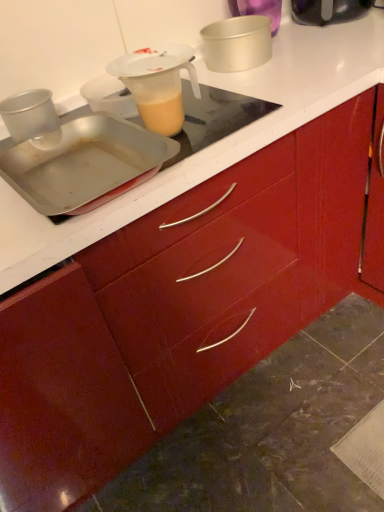
Find the location of `translucent plastic jug at upper center`. translucent plastic jug at upper center is located at coordinates (158, 84).

I want to click on metallic silver tray at upper left, which ranks as the 1th kitchen appliance in bottom-to-top order, so click(x=84, y=164).

Is metallic silver tray at upper left, arranged as the fourth kitchen appliance when viewed from the top, further to the viewer compared to translucent plastic jug at upper center?

No, it is in front of translucent plastic jug at upper center.

From the picture: Considering the sizes of objects metallic silver tray at upper left, arranged as the fourth kitchen appliance when viewed from the top, and translucent plastic jug at upper center in the image provided, who is wider, metallic silver tray at upper left, arranged as the fourth kitchen appliance when viewed from the top, or translucent plastic jug at upper center?

metallic silver tray at upper left, arranged as the fourth kitchen appliance when viewed from the top, is wider.

Measure the distance from metallic silver tray at upper left, arranged as the fourth kitchen appliance when viewed from the top, to translucent plastic jug at upper center.

A distance of 6.28 inches exists between metallic silver tray at upper left, arranged as the fourth kitchen appliance when viewed from the top, and translucent plastic jug at upper center.

Is metallic silver tray at upper left, which is the third kitchen appliance in right-to-left order, taller than translucent plastic jug at upper center?

Incorrect, the height of metallic silver tray at upper left, which is the third kitchen appliance in right-to-left order, is not larger of that of translucent plastic jug at upper center.

Would you say translucent plastic jug at upper center is outside metallic silver cake pan at upper center, the third kitchen appliance in the left-to-right sequence?

Indeed, translucent plastic jug at upper center is completely outside metallic silver cake pan at upper center, the third kitchen appliance in the left-to-right sequence.

Where is `the 2nd kitchen appliance positioned below the translucent plastic jug at upper center (from a real-world perspective)`? the 2nd kitchen appliance positioned below the translucent plastic jug at upper center (from a real-world perspective) is located at coordinates (237, 42).

In the scene shown: Are translucent plastic jug at upper center and metallic silver cake pan at upper center, which is counted as the third kitchen appliance, starting from the bottom, making contact?

No, translucent plastic jug at upper center is not making contact with metallic silver cake pan at upper center, which is counted as the third kitchen appliance, starting from the bottom.

Can you confirm if translucent plastic jug at upper center is bigger than metallic silver cake pan at upper center, which is counted as the third kitchen appliance, starting from the bottom?

No.

Consider the image. Does metallic silver tray at upper left, which ranks as the 1th kitchen appliance in bottom-to-top order, have a lesser width compared to metallic silver cake pan at upper center, the second kitchen appliance when ordered from right to left?

In fact, metallic silver tray at upper left, which ranks as the 1th kitchen appliance in bottom-to-top order, might be wider than metallic silver cake pan at upper center, the second kitchen appliance when ordered from right to left.

This screenshot has height=512, width=384. Identify the location of the 2nd kitchen appliance below when counting from the metallic silver cake pan at upper center, the second kitchen appliance when ordered from right to left (from the image's perspective). (84, 164).

Is metallic silver tray at upper left, the 2th kitchen appliance from the left, bigger than metallic silver cake pan at upper center, which is counted as the third kitchen appliance, starting from the bottom?

Indeed, metallic silver tray at upper left, the 2th kitchen appliance from the left, has a larger size compared to metallic silver cake pan at upper center, which is counted as the third kitchen appliance, starting from the bottom.

Considering the relative positions of black plastic toaster at upper right, positioned as the fourth kitchen appliance in left-to-right order, and metallic silver cup at left, which is the 2th kitchen appliance in bottom-to-top order, in the image provided, is black plastic toaster at upper right, positioned as the fourth kitchen appliance in left-to-right order, to the left of metallic silver cup at left, which is the 2th kitchen appliance in bottom-to-top order, from the viewer's perspective?

Incorrect, black plastic toaster at upper right, positioned as the fourth kitchen appliance in left-to-right order, is not on the left side of metallic silver cup at left, which is the 2th kitchen appliance in bottom-to-top order.

Which is nearer, (329, 8) or (46, 103)?

Point (329, 8) is farther from the camera than point (46, 103).

Are black plastic toaster at upper right, which is the 4th kitchen appliance in bottom-to-top order, and metallic silver cup at left, which appears as the first kitchen appliance when viewed from the left, located far from each other?

No, black plastic toaster at upper right, which is the 4th kitchen appliance in bottom-to-top order, is not far away from metallic silver cup at left, which appears as the first kitchen appliance when viewed from the left.

Would you say black plastic toaster at upper right, positioned as the fourth kitchen appliance in left-to-right order, is outside metallic silver cup at left, which is the 2th kitchen appliance in bottom-to-top order?

Yes, black plastic toaster at upper right, positioned as the fourth kitchen appliance in left-to-right order, is not within metallic silver cup at left, which is the 2th kitchen appliance in bottom-to-top order.

Based on the photo, is translucent plastic jug at upper center positioned with its back to metallic silver cup at left, the fourth kitchen appliance positioned from the right?

No, metallic silver cup at left, the fourth kitchen appliance positioned from the right, is not at the back of translucent plastic jug at upper center.

Would you say translucent plastic jug at upper center is inside or outside metallic silver cup at left, positioned as the third kitchen appliance in top-to-bottom order?

translucent plastic jug at upper center lies outside metallic silver cup at left, positioned as the third kitchen appliance in top-to-bottom order.

Is translucent plastic jug at upper center wider or thinner than metallic silver cup at left, the fourth kitchen appliance positioned from the right?

translucent plastic jug at upper center is wider than metallic silver cup at left, the fourth kitchen appliance positioned from the right.

Which point is more distant from viewer, (172, 99) or (38, 96)?

Point (38, 96)

Is translucent plastic jug at upper center to the left of black plastic toaster at upper right, positioned as the fourth kitchen appliance in left-to-right order, from the viewer's perspective?

Indeed, translucent plastic jug at upper center is positioned on the left side of black plastic toaster at upper right, positioned as the fourth kitchen appliance in left-to-right order.

Is point (157, 71) positioned in front of point (360, 4)?

Yes, it is in front of point (360, 4).

Is translucent plastic jug at upper center outside of black plastic toaster at upper right, positioned as the 1th kitchen appliance in top-to-bottom order?

Yes, translucent plastic jug at upper center is outside of black plastic toaster at upper right, positioned as the 1th kitchen appliance in top-to-bottom order.

In terms of height, does translucent plastic jug at upper center look taller or shorter compared to black plastic toaster at upper right, positioned as the 1th kitchen appliance in top-to-bottom order?

In the image, translucent plastic jug at upper center appears to be taller than black plastic toaster at upper right, positioned as the 1th kitchen appliance in top-to-bottom order.

Is metallic silver tray at upper left, which ranks as the 1th kitchen appliance in bottom-to-top order, inside translucent plastic jug at upper center?

No, metallic silver tray at upper left, which ranks as the 1th kitchen appliance in bottom-to-top order, is located outside of translucent plastic jug at upper center.

Between translucent plastic jug at upper center and metallic silver tray at upper left, which is the third kitchen appliance in right-to-left order, which one has larger size?

metallic silver tray at upper left, which is the third kitchen appliance in right-to-left order, is bigger.

Is translucent plastic jug at upper center in contact with metallic silver tray at upper left, the 2th kitchen appliance from the left?

No, translucent plastic jug at upper center is not beside metallic silver tray at upper left, the 2th kitchen appliance from the left.

Which point is more forward, (x=164, y=106) or (x=85, y=209)?

The point (x=85, y=209) is closer to the camera.

You are a GUI agent. You are given a task and a screenshot of the screen. Output one action in this format:
    pyautogui.click(x=<x>, y=<y>)
    Task: Click on the kitchen appliance in front of the translucent plastic jug at upper center
    The height and width of the screenshot is (512, 384).
    Given the screenshot: What is the action you would take?
    pyautogui.click(x=84, y=164)

You are a GUI agent. You are given a task and a screenshot of the screen. Output one action in this format:
    pyautogui.click(x=<x>, y=<y>)
    Task: Click on the jug below the metallic silver cake pan at upper center, the second kitchen appliance when ordered from right to left (from the image's perspective)
    The height and width of the screenshot is (512, 384).
    Given the screenshot: What is the action you would take?
    pyautogui.click(x=158, y=84)

When comparing their distances from metallic silver cup at left, positioned as the third kitchen appliance in top-to-bottom order, does metallic silver cake pan at upper center, which is counted as the third kitchen appliance, starting from the bottom, or black plastic toaster at upper right, which is the first kitchen appliance in right-to-left order, seem further?

black plastic toaster at upper right, which is the first kitchen appliance in right-to-left order, lies further to metallic silver cup at left, positioned as the third kitchen appliance in top-to-bottom order, than the other object.

Estimate the real-world distances between objects in this image. Which object is closer to metallic silver tray at upper left, which ranks as the 1th kitchen appliance in bottom-to-top order, black plastic toaster at upper right, which is the 4th kitchen appliance in bottom-to-top order, or translucent plastic jug at upper center?

translucent plastic jug at upper center is positioned closer to the anchor metallic silver tray at upper left, which ranks as the 1th kitchen appliance in bottom-to-top order.

When comparing their distances from black plastic toaster at upper right, which is the 4th kitchen appliance in bottom-to-top order, does translucent plastic jug at upper center or metallic silver cake pan at upper center, the third kitchen appliance in the left-to-right sequence, seem closer?

metallic silver cake pan at upper center, the third kitchen appliance in the left-to-right sequence, lies closer to black plastic toaster at upper right, which is the 4th kitchen appliance in bottom-to-top order, than the other object.

Estimate the real-world distances between objects in this image. Which object is closer to translucent plastic jug at upper center, metallic silver tray at upper left, arranged as the fourth kitchen appliance when viewed from the top, or black plastic toaster at upper right, positioned as the 1th kitchen appliance in top-to-bottom order?

Among the two, metallic silver tray at upper left, arranged as the fourth kitchen appliance when viewed from the top, is located nearer to translucent plastic jug at upper center.

Which object lies nearer to the anchor point metallic silver cake pan at upper center, the second kitchen appliance in the top-to-bottom sequence, metallic silver tray at upper left, which ranks as the 1th kitchen appliance in bottom-to-top order, or translucent plastic jug at upper center?

Among the two, translucent plastic jug at upper center is located nearer to metallic silver cake pan at upper center, the second kitchen appliance in the top-to-bottom sequence.

Looking at the image, which one is located further to translucent plastic jug at upper center, metallic silver cake pan at upper center, the second kitchen appliance in the top-to-bottom sequence, or metallic silver cup at left, which appears as the first kitchen appliance when viewed from the left?

metallic silver cake pan at upper center, the second kitchen appliance in the top-to-bottom sequence, lies further to translucent plastic jug at upper center than the other object.

Considering their positions, is metallic silver tray at upper left, which ranks as the 1th kitchen appliance in bottom-to-top order, positioned closer to black plastic toaster at upper right, positioned as the 1th kitchen appliance in top-to-bottom order, than translucent plastic jug at upper center?

translucent plastic jug at upper center is positioned closer to the anchor black plastic toaster at upper right, positioned as the 1th kitchen appliance in top-to-bottom order.

Looking at the image, which one is located further to black plastic toaster at upper right, which is the first kitchen appliance in right-to-left order, metallic silver cake pan at upper center, the second kitchen appliance when ordered from right to left, or metallic silver tray at upper left, which ranks as the 1th kitchen appliance in bottom-to-top order?

metallic silver tray at upper left, which ranks as the 1th kitchen appliance in bottom-to-top order.

You are a GUI agent. You are given a task and a screenshot of the screen. Output one action in this format:
    pyautogui.click(x=<x>, y=<y>)
    Task: Click on the jug located between metallic silver tray at upper left, arranged as the fourth kitchen appliance when viewed from the top, and black plastic toaster at upper right, which is the 4th kitchen appliance in bottom-to-top order, in the left-right direction
    
    Given the screenshot: What is the action you would take?
    pyautogui.click(x=158, y=84)

At what (x,y) coordinates should I click in order to perform the action: click on kitchen appliance situated between metallic silver cup at left, positioned as the third kitchen appliance in top-to-bottom order, and translucent plastic jug at upper center from left to right. Please return your answer as a coordinate pair (x, y). This screenshot has width=384, height=512. Looking at the image, I should click on (84, 164).

Where is `jug positioned between metallic silver tray at upper left, arranged as the fourth kitchen appliance when viewed from the top, and metallic silver cake pan at upper center, the third kitchen appliance in the left-to-right sequence, from near to far`? The image size is (384, 512). jug positioned between metallic silver tray at upper left, arranged as the fourth kitchen appliance when viewed from the top, and metallic silver cake pan at upper center, the third kitchen appliance in the left-to-right sequence, from near to far is located at coordinates (158, 84).

Identify the location of kitchen appliance situated between translucent plastic jug at upper center and black plastic toaster at upper right, which is the 4th kitchen appliance in bottom-to-top order, from left to right. (237, 42).